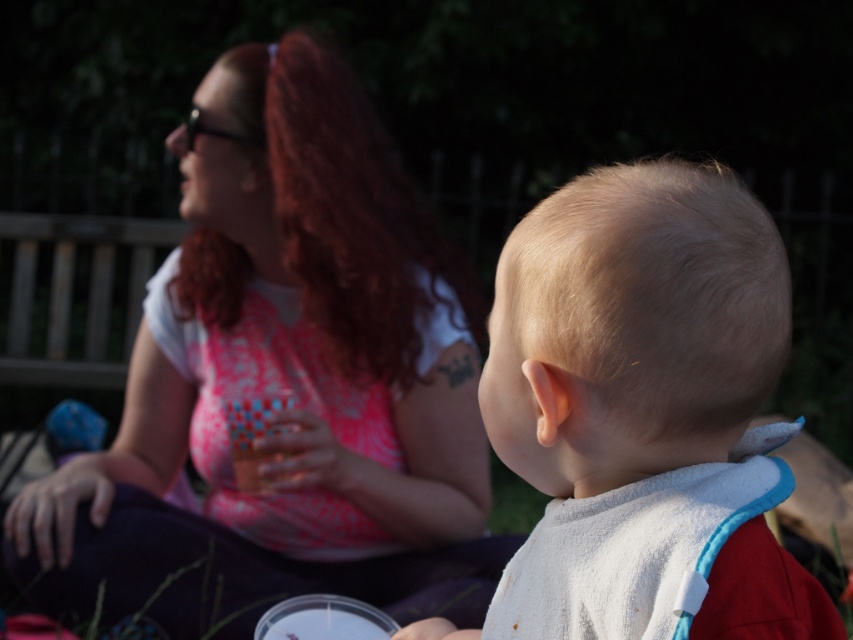
Question: Which of the following is the farthest from the observer?

Choices:
 (A) (753, 349)
 (B) (234, 93)

Answer: (B)

Question: Does pink printed fabric at upper left appear on the right side of blonde hair at center?

Choices:
 (A) yes
 (B) no

Answer: (B)

Question: Does pink printed fabric at upper left appear on the right side of blonde hair at center?

Choices:
 (A) no
 (B) yes

Answer: (A)

Question: Can you confirm if pink printed fabric at upper left is thinner than blonde hair at center?

Choices:
 (A) yes
 (B) no

Answer: (B)